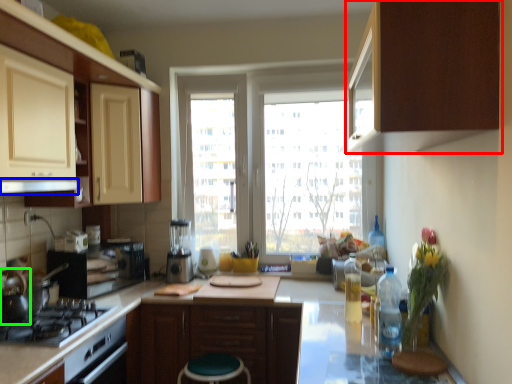
Question: Which object is the closest to the cabinetry (highlighted by a red box)? Choose among these: exhaust hood (highlighted by a blue box) or tea pot (highlighted by a green box).

Choices:
 (A) exhaust hood
 (B) tea pot

Answer: (A)